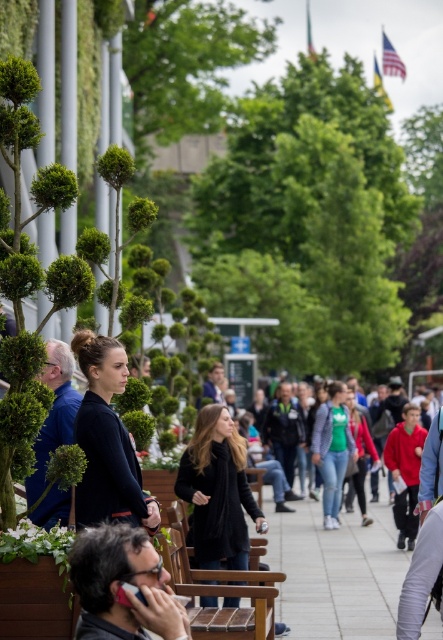
You are standing in the pedestrian walkway and see the matte black jacket at left and the green fabric jacket at center. Which jacket is positioned more to the left?

The matte black jacket at left is positioned more to the left than the green fabric jacket at center.

Consider the image. You are a photographer trying to capture both the matte black jacket at left and the green fabric jacket at center in a single frame. Which jacket should you focus on first to ensure both are in the frame?

The matte black jacket at left is smaller in size compared to the green fabric jacket at center, so you should focus on the larger green fabric jacket at center first to ensure both fit within the frame.